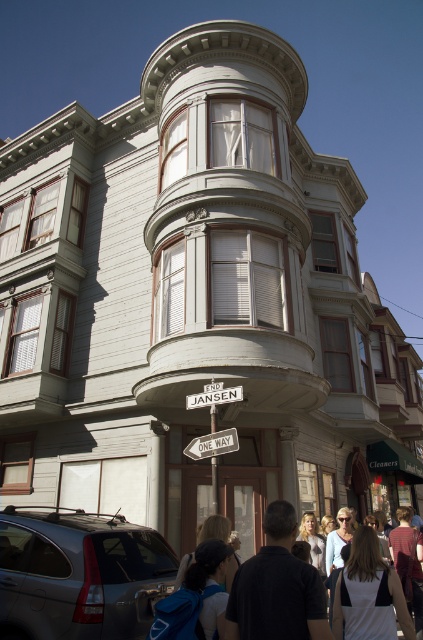
Question: Can you confirm if satin silver suv at lower left is smaller than metallic silver one-way sign at center?

Choices:
 (A) yes
 (B) no

Answer: (B)

Question: Which point is closer to the camera?

Choices:
 (A) matte black backpack at lower center
 (B) satin silver suv at lower left
 (C) metallic silver one-way sign at center

Answer: (A)

Question: Observing the image, what is the correct spatial positioning of matte black backpack at lower center in reference to metallic silver one-way sign at center?

Choices:
 (A) above
 (B) below

Answer: (B)

Question: Is matte black backpack at lower center positioned behind metallic silver one-way sign at center?

Choices:
 (A) yes
 (B) no

Answer: (B)

Question: Which point appears closest to the camera in this image?

Choices:
 (A) (84, 522)
 (B) (269, 556)
 (C) (216, 452)

Answer: (B)

Question: Which object appears closest to the camera in this image?

Choices:
 (A) matte black backpack at lower center
 (B) satin silver suv at lower left

Answer: (A)